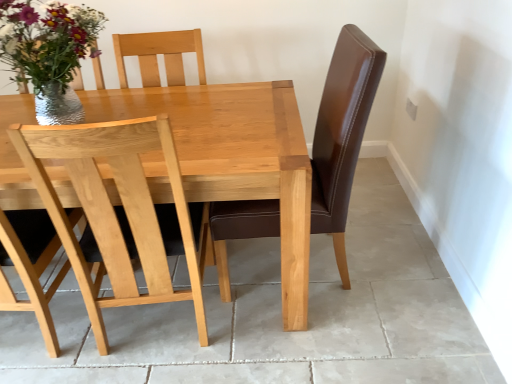
Find the location of a particular element. free space that is to the left of light wood chair at center is located at coordinates (59, 336).